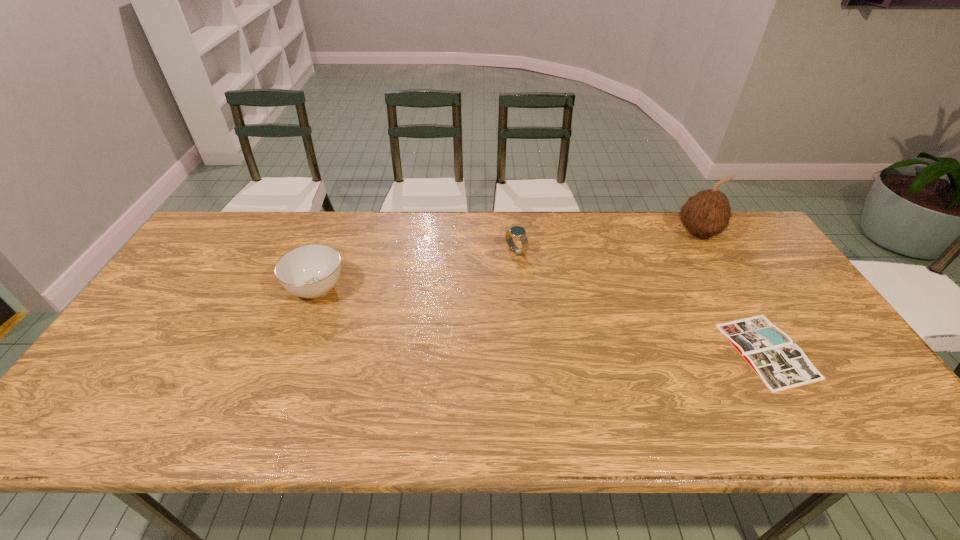
In order to click on vacant point located 0.160m on the back of the nearest object in this screenshot , I will do `click(722, 274)`.

You are a GUI agent. You are given a task and a screenshot of the screen. Output one action in this format:
    pyautogui.click(x=<x>, y=<y>)
    Task: Click on the coconut that is at the far edge
    The height and width of the screenshot is (540, 960).
    Given the screenshot: What is the action you would take?
    pyautogui.click(x=707, y=213)

What are the coordinates of `watch present at the far edge` in the screenshot? It's located at (519, 232).

Where is `coconut present at the right edge`? coconut present at the right edge is located at coordinates pos(707,213).

The height and width of the screenshot is (540, 960). Find the location of `book that is at the right edge`. book that is at the right edge is located at coordinates (781, 365).

I want to click on object that is at the far right corner, so click(707, 213).

In the image, there is a desktop. Where is `free space at the far edge`? This screenshot has height=540, width=960. free space at the far edge is located at coordinates (418, 218).

This screenshot has height=540, width=960. In order to click on free space at the left edge of the desktop in this screenshot , I will do `click(137, 327)`.

The width and height of the screenshot is (960, 540). In the image, there is a desktop. What are the coordinates of `vacant region at the right edge` in the screenshot? It's located at (767, 305).

Identify the location of blank area at the near left corner. (108, 428).